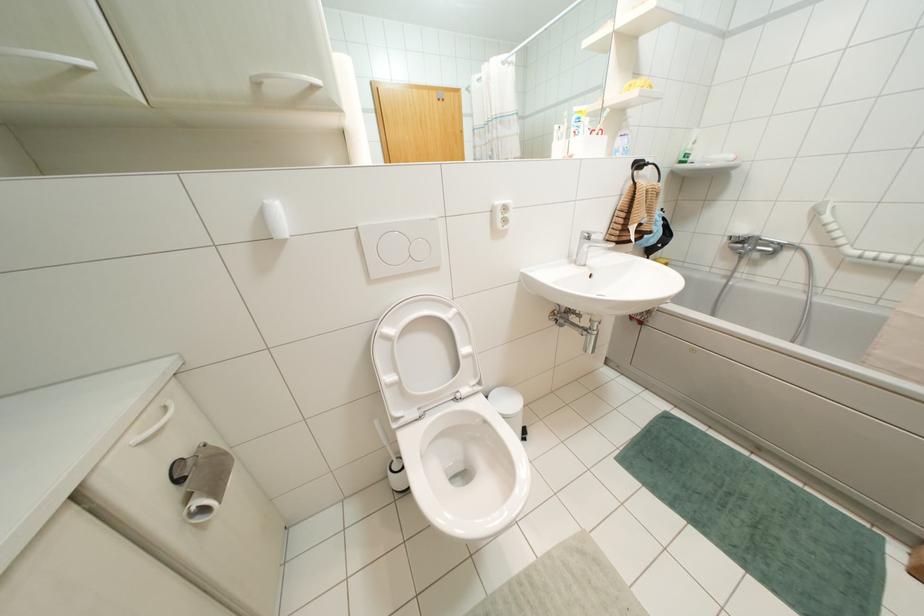
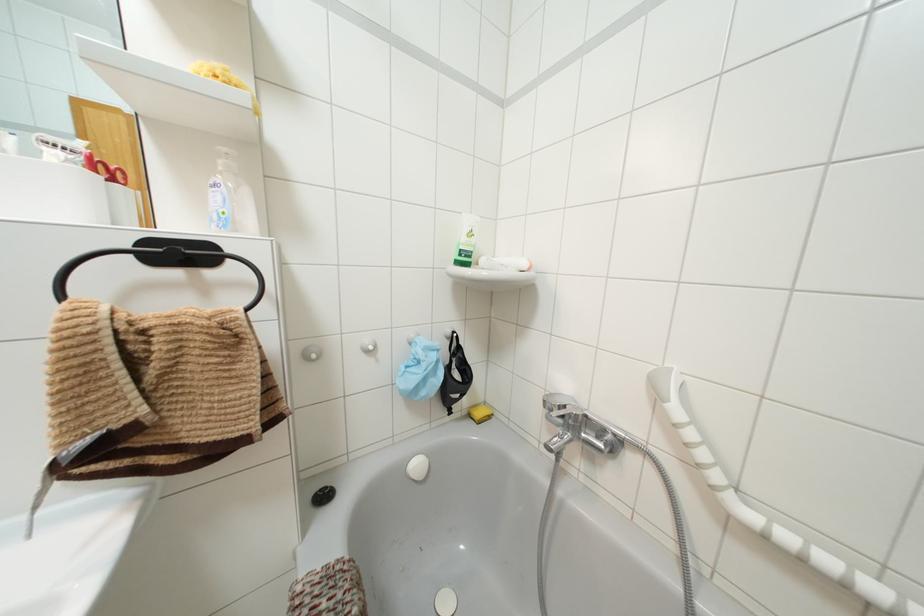
Which direction would the cameraman need to move to produce the second image?

The movement direction of the cameraman is right, forward.